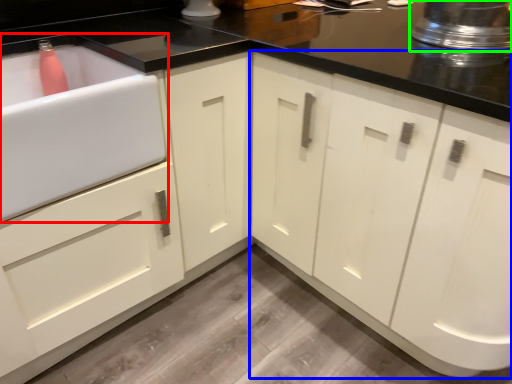
Question: Which object is positioned farthest from sink (highlighted by a red box)? Select from cabinetry (highlighted by a blue box) and appliance (highlighted by a green box).

Choices:
 (A) cabinetry
 (B) appliance

Answer: (B)